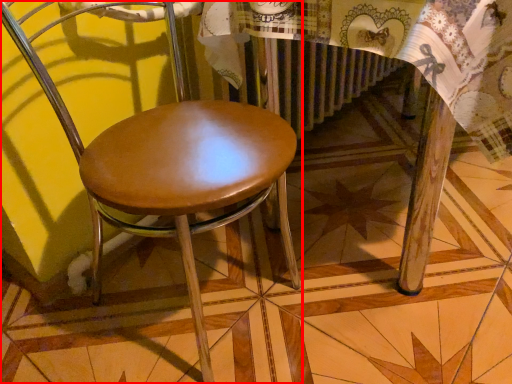
Question: From the image's perspective, what is the correct spatial positioning of chair (annotated by the red box) in reference to round table?

Choices:
 (A) above
 (B) below

Answer: (B)